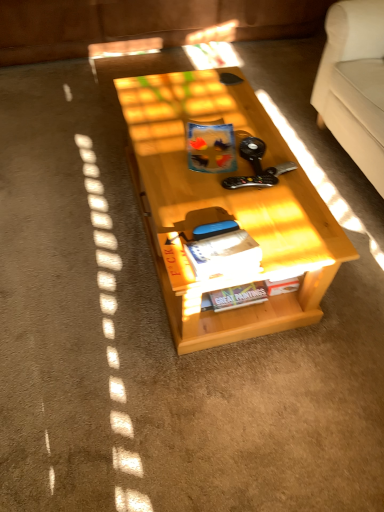
Find the location of a particular element. The image size is (384, 512). vacant space underneath matte plastic book at center, placed as the 3th book when sorted from bottom to top (from a real-world perspective) is located at coordinates (222, 160).